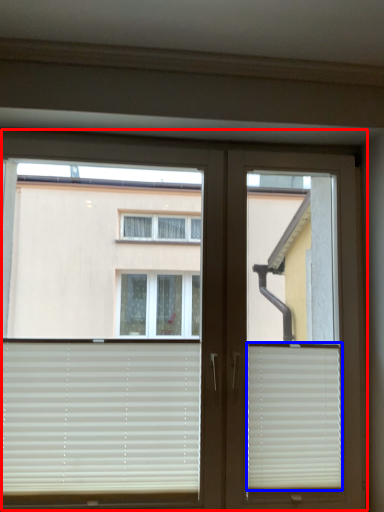
Question: Among these objects, which one is nearest to the camera, window (highlighted by a red box) or window blind (highlighted by a blue box)?

Choices:
 (A) window
 (B) window blind

Answer: (A)